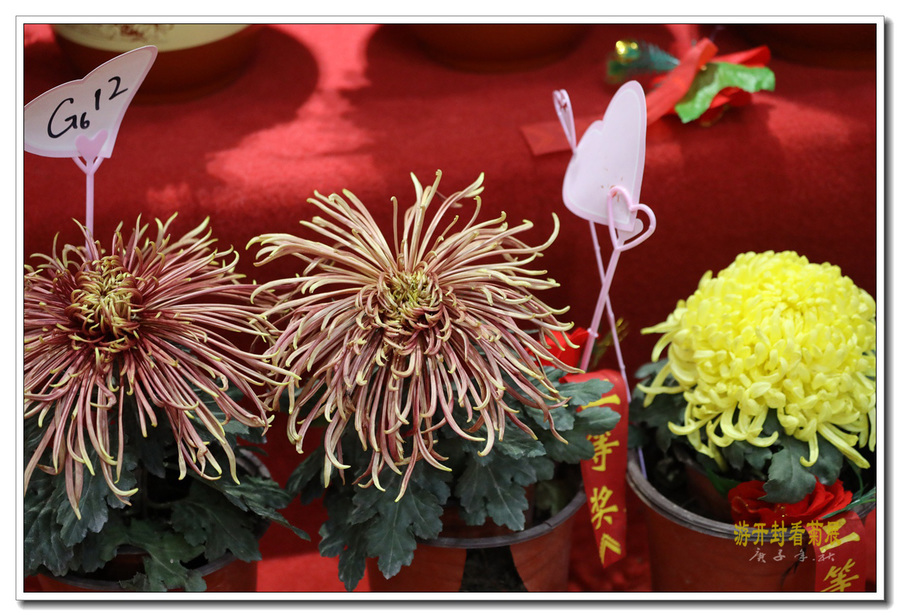
At what (x,y) coordinates should I click in order to perform the action: click on shadows from planters. Please return your answer as a coordinate pair (x, y). The image size is (900, 616). Looking at the image, I should click on (423, 111), (202, 111).